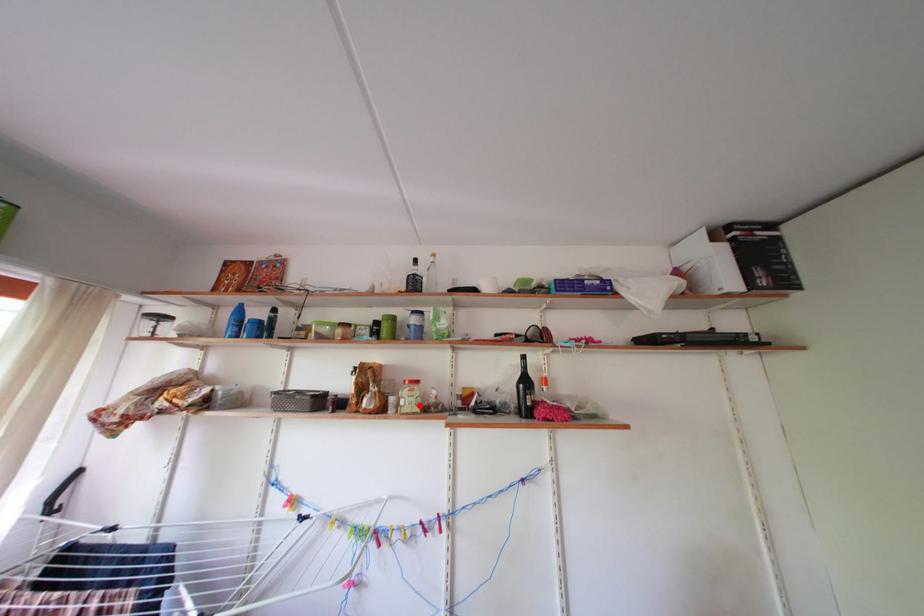
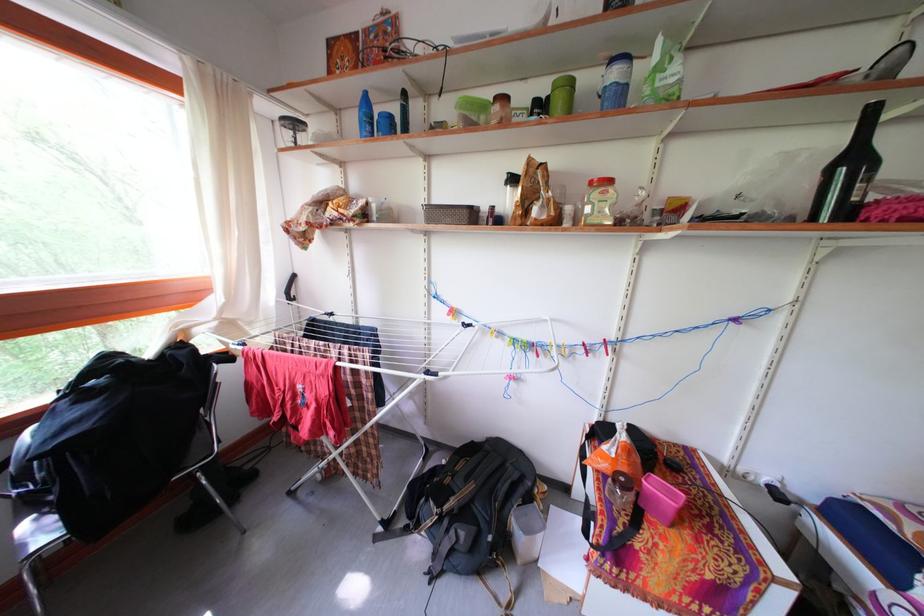
In the second image, find the point that corresponds to the highlighted location in the first image.

(611, 211)